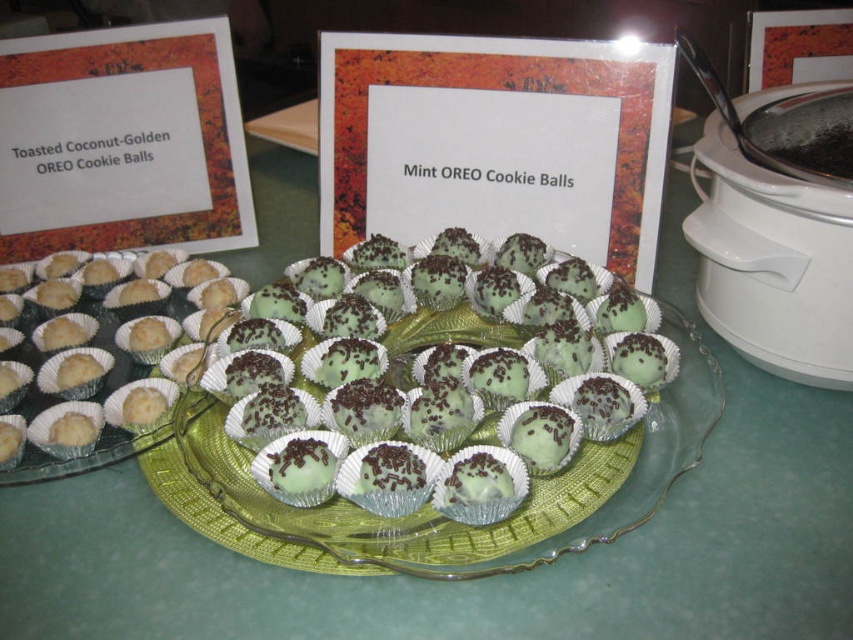
You are a customer at a bakery and want to choose between the mint chocolate cookie balls at center and the white matte muffin at left. If you prefer a larger treat, which one should you pick?

The mint chocolate cookie balls at center has a larger size compared to the white matte muffin at left, so you should choose the mint chocolate cookie balls at center if you prefer a larger treat.

You are organizing a dessert table and need to place a new dessert between the mint chocolate cookie balls at center and the white matte muffin at left. Where should you place it to ensure it is between them?

The new dessert should be placed to the right of the white matte muffin at left and to the left of the mint chocolate cookie balls at center since the mint chocolate cookie balls at center is to the right of the white matte muffin at left.

You are at a bakery counter and want to buy both the mint chocolate cookie balls at center and the white matte muffin at left. Which item is positioned lower on the display?

The mint chocolate cookie balls at center is located below the white matte muffin at left, so the mint chocolate cookie balls at center is positioned lower on the display.